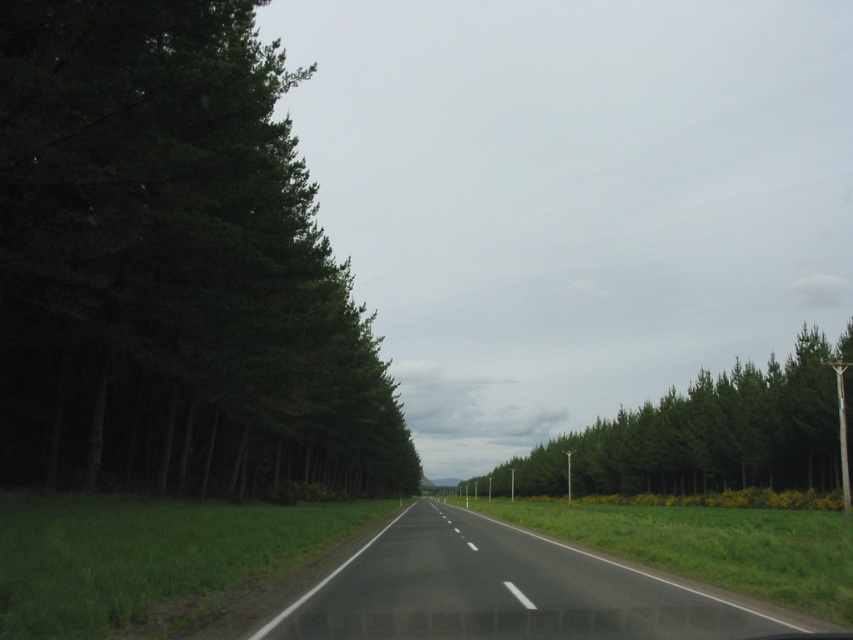
Is black asphalt road at center above green leafy trees at center?

No.

Consider the image. Is black asphalt road at center wider than green leafy trees at center?

Incorrect, black asphalt road at center's width does not surpass green leafy trees at center's.

The width and height of the screenshot is (853, 640). I want to click on black asphalt road at center, so click(502, 589).

Which of these two, dark green textured trees at left or black asphalt road at center, stands shorter?

black asphalt road at center

Does point (230, 106) come in front of point (473, 620)?

No, (230, 106) is behind (473, 620).

Describe the element at coordinates (173, 268) in the screenshot. I see `dark green textured trees at left` at that location.

This screenshot has height=640, width=853. What are the coordinates of `dark green textured trees at left` in the screenshot? It's located at (173, 268).

Between dark green textured trees at left and green leafy trees at center, which one appears on the left side from the viewer's perspective?

dark green textured trees at left

Is dark green textured trees at left thinner than green leafy trees at center?

Indeed, dark green textured trees at left has a lesser width compared to green leafy trees at center.

Locate an element on the screen. dark green textured trees at left is located at coordinates (173, 268).

Where is `dark green textured trees at left`? The width and height of the screenshot is (853, 640). dark green textured trees at left is located at coordinates (173, 268).